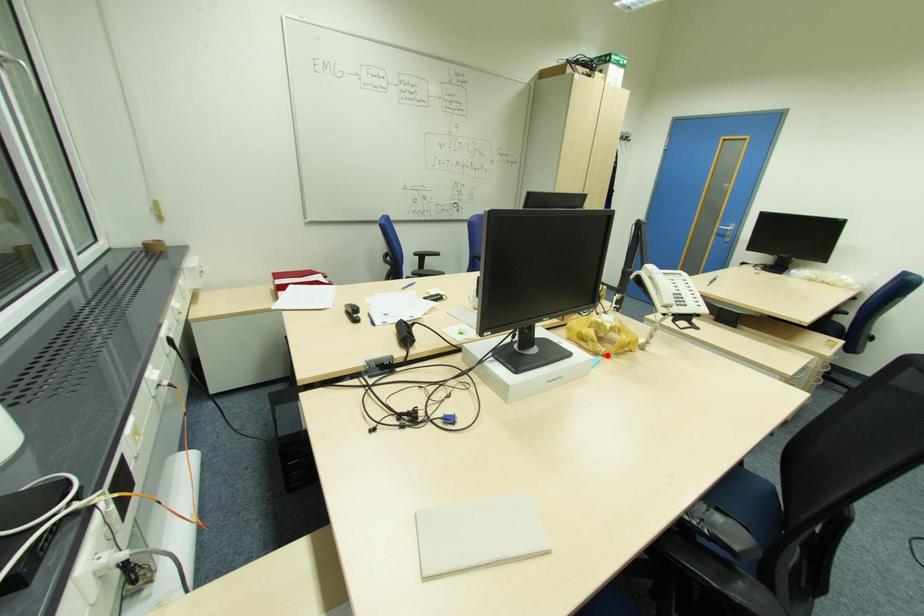
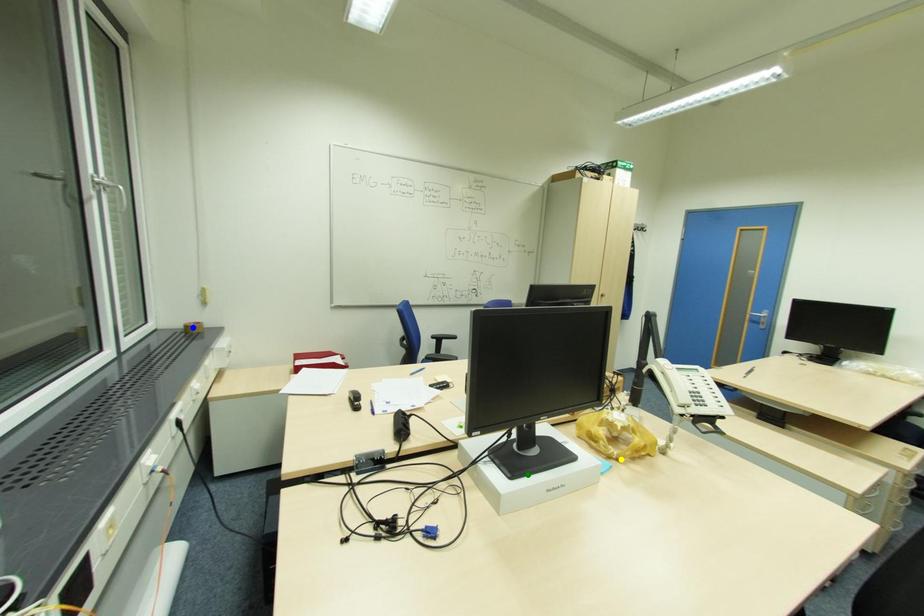
Question: I am providing you with two images of the same scene from different viewpoints. A red point is marked on the first image. You are given multiple points on the second image. In image 2, which mark is for the same physical point as the one in image 1?

Choices:
 (A) yellow point
 (B) blue point
 (C) green point

Answer: (A)